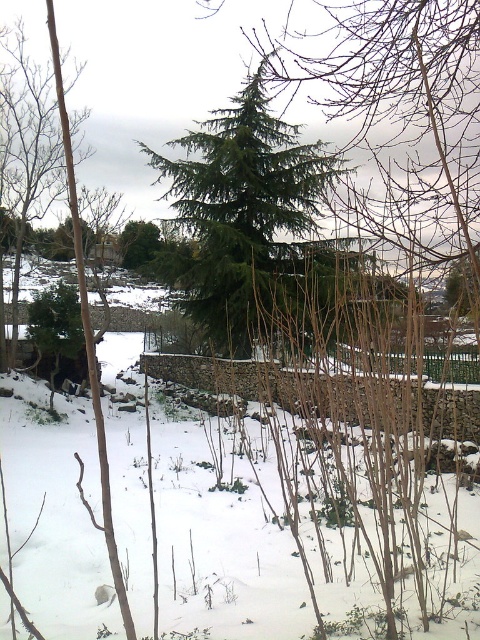
Question: Which point is farther from the camera taking this photo?

Choices:
 (A) (310, 388)
 (B) (118, 250)
 (C) (41, 141)

Answer: (B)

Question: Is green needle-like tree at center above brown wood tree at left?

Choices:
 (A) yes
 (B) no

Answer: (A)

Question: Based on their relative distances, which object is nearer to the green needle-like tree at center?

Choices:
 (A) green wooden fence at center
 (B) brown wood tree at left
 (C) green matte tree at center

Answer: (B)

Question: Which of these objects is positioned closest to the green wooden fence at center?

Choices:
 (A) green needle-like tree at center
 (B) green matte tree at center

Answer: (A)

Question: Does brown wood tree at left appear over green wooden fence at center?

Choices:
 (A) yes
 (B) no

Answer: (A)

Question: Is green wooden fence at center to the left of green matte tree at center from the viewer's perspective?

Choices:
 (A) yes
 (B) no

Answer: (B)